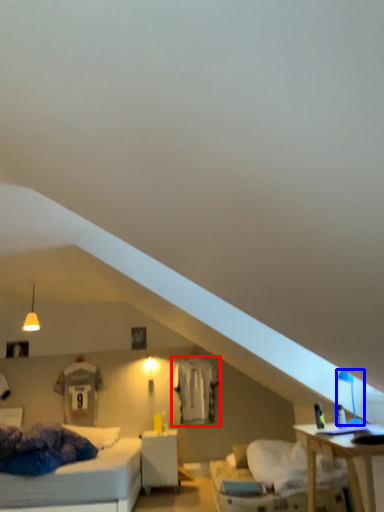
Question: Which point is further to the camera, sheet (highlighted by a red box) or table lamp (highlighted by a blue box)?

Choices:
 (A) sheet
 (B) table lamp

Answer: (A)